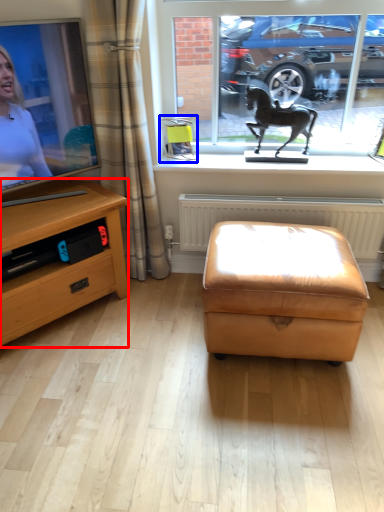
Question: Which object appears closest to the camera in this image, desk (highlighted by a red box) or picture frame (highlighted by a blue box)?

Choices:
 (A) desk
 (B) picture frame

Answer: (A)